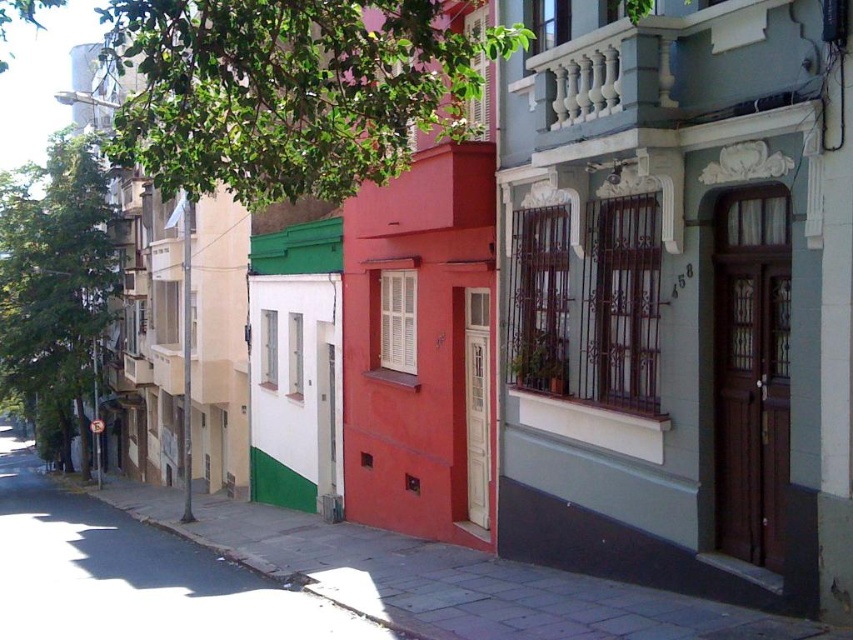
Question: Does smooth concrete sidewalk at lower center have a larger size compared to green matte wall at center?

Choices:
 (A) yes
 (B) no

Answer: (B)

Question: Is smooth concrete sidewalk at lower center wider than green matte wall at center?

Choices:
 (A) no
 (B) yes

Answer: (A)

Question: Can you confirm if smooth concrete sidewalk at lower center is positioned below green matte wall at center?

Choices:
 (A) no
 (B) yes

Answer: (A)